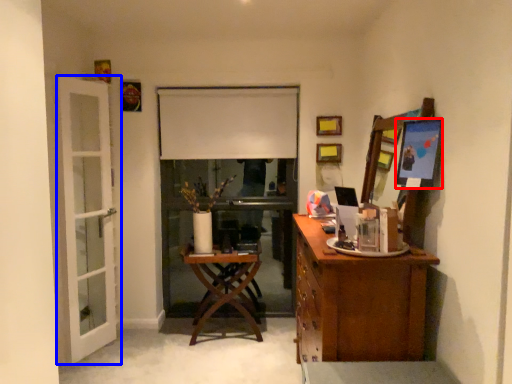
Question: Among these objects, which one is farthest to the camera, picture frame (highlighted by a red box) or door (highlighted by a blue box)?

Choices:
 (A) picture frame
 (B) door

Answer: (B)